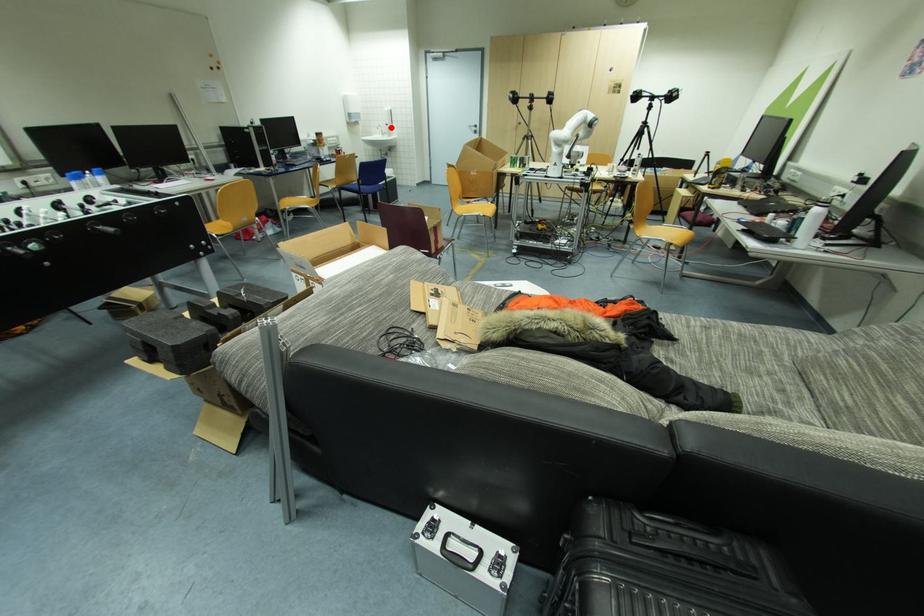
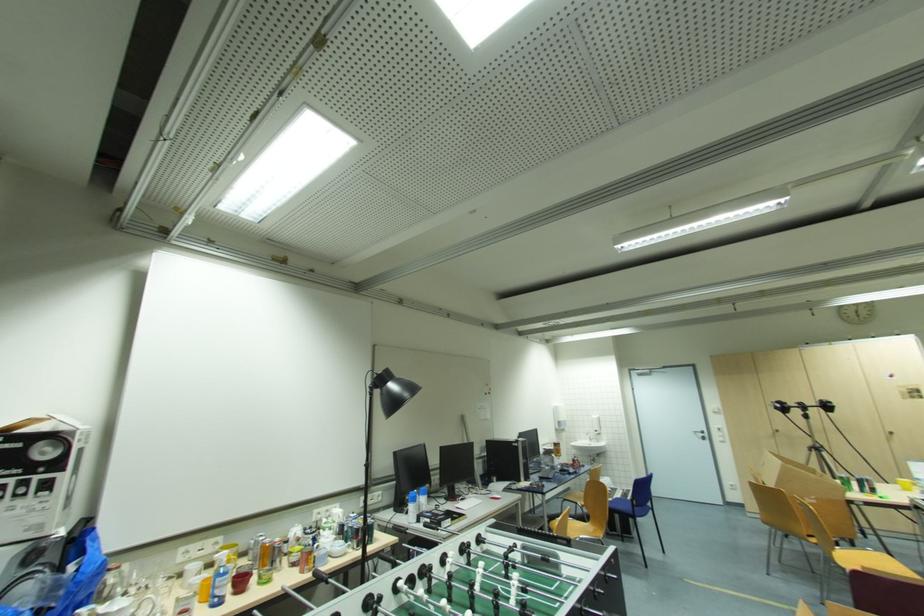
Question: I am providing you with two images of the same scene from different viewpoints. Image1 has a red point marked. In image2, the corresponding 3D location appears at what relative position? Reply with the corresponding letter.

Choices:
 (A) Closer
 (B) Farther

Answer: (B)